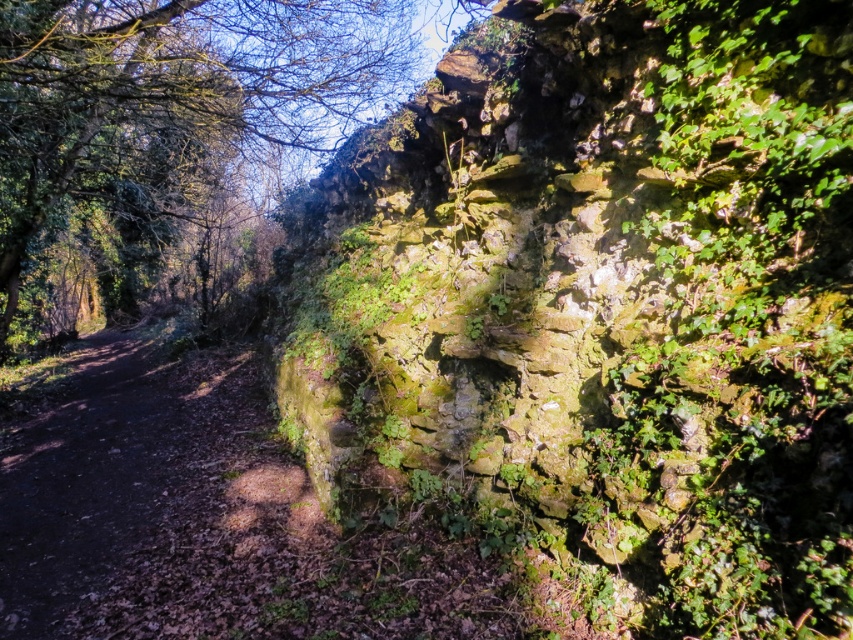
You are a painter standing at the end of the dirt path and want to paint both the green mossy stone wall at upper right and the green mossy wall at upper center. Which wall should you paint first if you want to paint them in the order they appear from left to right?

The green mossy wall at upper center should be painted first because it is positioned to the left of the green mossy stone wall at upper right.

You are standing on the dirt path in the forest scene. You see a point marked at coordinates (x=602, y=301). What object does this point correspond to?

The point at coordinates (x=602, y=301) corresponds to the green mossy stone wall at upper right.

You are a hiker carrying a backpack and standing on the narrow dirt path. You want to lean against the green mossy stone wall at upper right to take a break. Can you safely reach the wall without stepping off the path?

The green mossy stone wall at upper right is 7.29 feet away from you. Since the path is narrow and the wall is 7.29 feet away, you can safely reach the wall without stepping off the path as the distance is manageable for leaning.